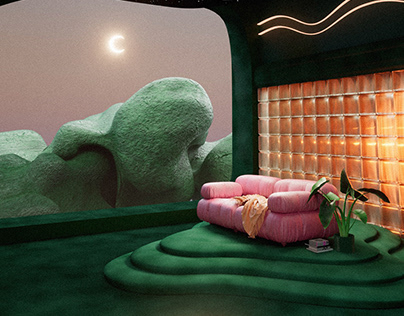
Locate an element on the screen. curved screen is located at coordinates (214, 9), (8, 1).